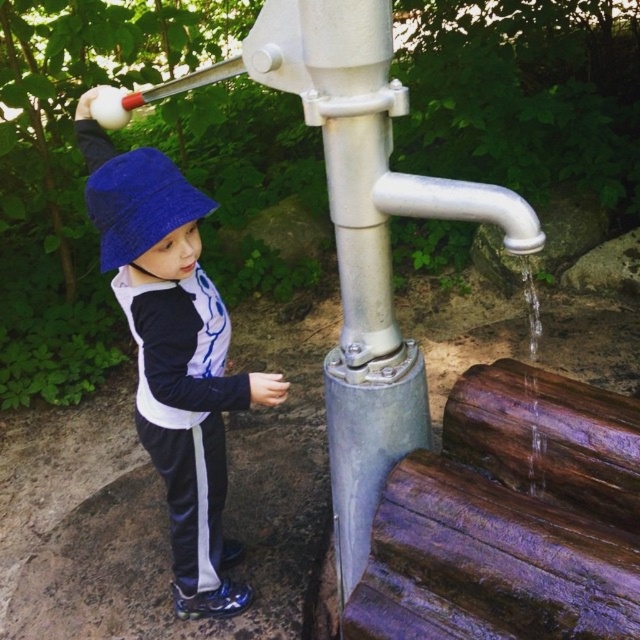
Question: From the image, what is the correct spatial relationship of matte blue bucket hat at left in relation to clear water at lower right?

Choices:
 (A) right
 (B) left

Answer: (B)

Question: Which point is closer to the camera?

Choices:
 (A) blue knitted hat at left
 (B) matte blue bucket hat at left
 (C) clear water at lower right

Answer: (A)

Question: Which object is the farthest from the blue knitted hat at left?

Choices:
 (A) matte blue bucket hat at left
 (B) clear water at lower right

Answer: (B)

Question: Is blue knitted hat at left smaller than clear water at lower right?

Choices:
 (A) yes
 (B) no

Answer: (B)

Question: Which of these objects is positioned closest to the matte blue bucket hat at left?

Choices:
 (A) clear water at lower right
 (B) blue knitted hat at left

Answer: (B)

Question: Is matte blue bucket hat at left smaller than clear water at lower right?

Choices:
 (A) no
 (B) yes

Answer: (A)